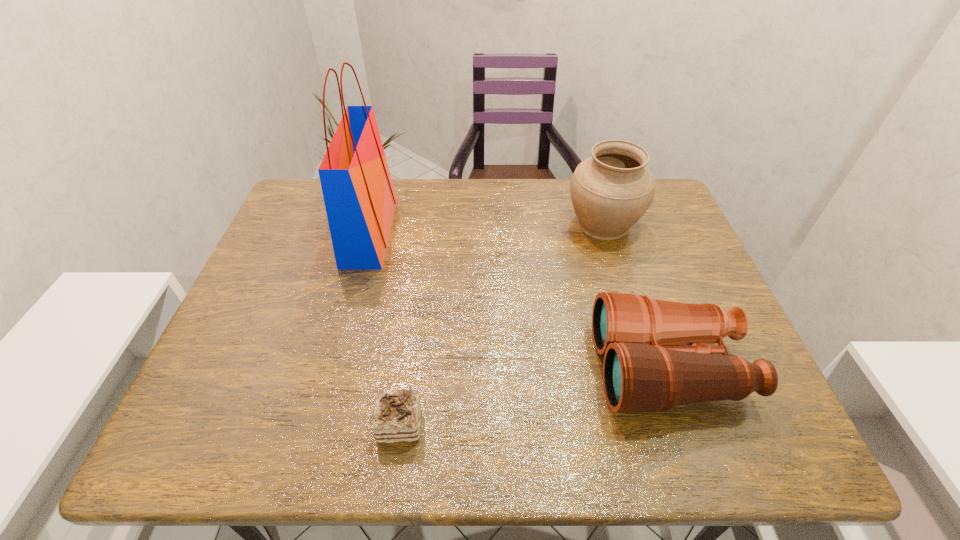
Locate an element on the screen. This screenshot has height=540, width=960. vacant space located through the lenses of the third tallest object is located at coordinates (501, 368).

Where is `vacant space located 0.200m on the right of the chocolate cake`? vacant space located 0.200m on the right of the chocolate cake is located at coordinates (524, 424).

Locate an element on the screen. The width and height of the screenshot is (960, 540). shopping bag that is positioned at the far edge is located at coordinates [x=359, y=196].

Locate an element on the screen. Image resolution: width=960 pixels, height=540 pixels. urn located at the far edge is located at coordinates (610, 191).

This screenshot has height=540, width=960. Find the location of `binoculars present at the near edge`. binoculars present at the near edge is located at coordinates (645, 370).

Locate an element on the screen. chocolate cake present at the near edge is located at coordinates (396, 419).

I want to click on urn located in the right edge section of the desktop, so click(x=610, y=191).

This screenshot has width=960, height=540. What are the coordinates of `binoculars located at the right edge` in the screenshot? It's located at (645, 370).

Locate an element on the screen. The width and height of the screenshot is (960, 540). object that is positioned at the far right corner is located at coordinates (610, 191).

This screenshot has width=960, height=540. I want to click on object that is positioned at the near right corner, so click(645, 370).